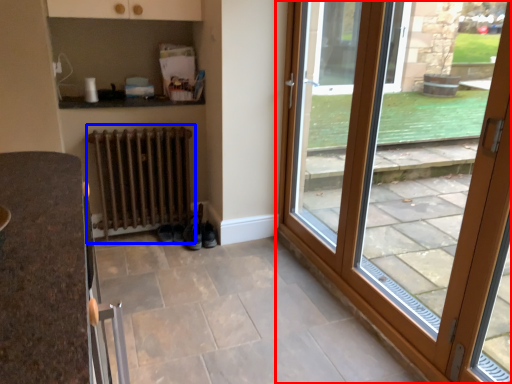
Question: Which of the following is the closest to the observer, door (highlighted by a red box) or radiator (highlighted by a blue box)?

Choices:
 (A) door
 (B) radiator

Answer: (A)